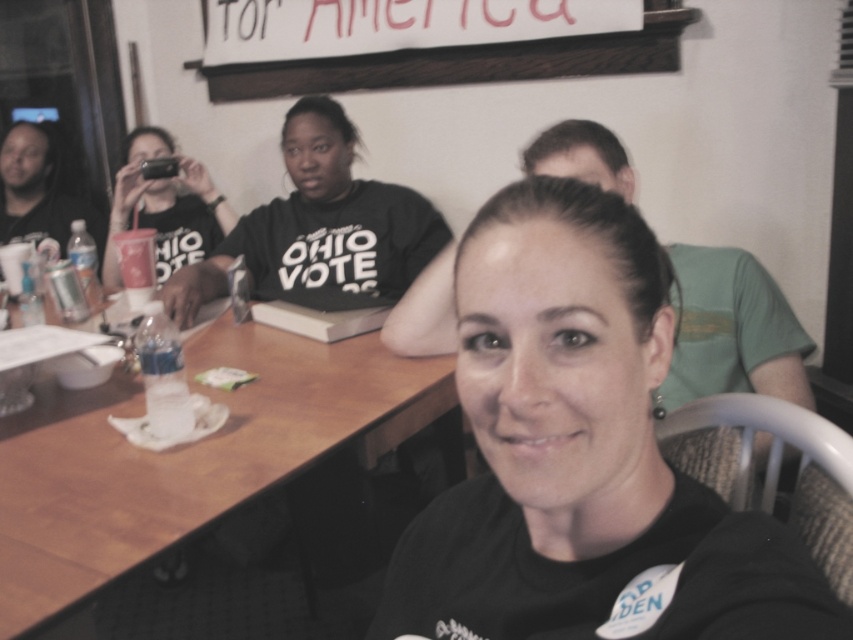
Question: Which object is farther from the camera taking this photo?

Choices:
 (A) wooden table at center
 (B) matte black phone at upper left

Answer: (B)

Question: Is wooden table at center thinner than black matte shirt at upper center?

Choices:
 (A) no
 (B) yes

Answer: (A)

Question: Can you confirm if wooden table at center is bigger than wooden signboard at upper center?

Choices:
 (A) no
 (B) yes

Answer: (A)

Question: Where is wooden table at center located in relation to matte black phone at upper left in the image?

Choices:
 (A) right
 (B) left

Answer: (A)

Question: Which point is farther from the camera taking this photo?

Choices:
 (A) (160, 272)
 (B) (473, 72)
 (C) (316, 234)
 (D) (729, 637)

Answer: (A)

Question: Which object appears closest to the camera in this image?

Choices:
 (A) matte black phone at upper left
 (B) wooden signboard at upper center

Answer: (B)